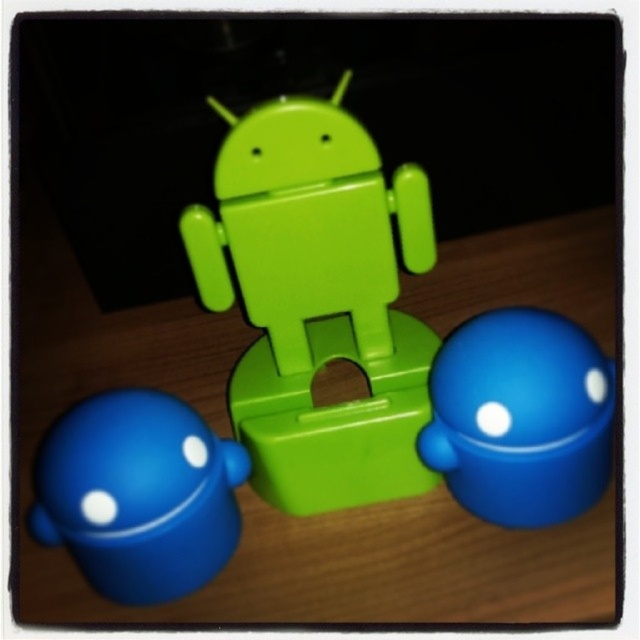
Can you confirm if wooden table at center is positioned to the left of green matte android at center?

Yes, wooden table at center is to the left of green matte android at center.

Between wooden table at center and green matte android at center, which one has more height?

With more height is wooden table at center.

Where is `wooden table at center`? The width and height of the screenshot is (640, 640). wooden table at center is located at coordinates (260, 499).

Identify the location of wooden table at center. Image resolution: width=640 pixels, height=640 pixels. (260, 499).

Does green matte android at center appear on the left side of matte blue toy at lower left?

Incorrect, green matte android at center is not on the left side of matte blue toy at lower left.

Is green matte android at center in front of matte blue toy at lower left?

No, it is not.

This screenshot has height=640, width=640. Describe the element at coordinates (317, 301) in the screenshot. I see `green matte android at center` at that location.

Where is `green matte android at center`? The image size is (640, 640). green matte android at center is located at coordinates [317, 301].

Can you confirm if wooden table at center is positioned to the right of matte blue sphere at lower right?

Incorrect, wooden table at center is not on the right side of matte blue sphere at lower right.

Does wooden table at center appear over matte blue sphere at lower right?

Yes, wooden table at center is above matte blue sphere at lower right.

I want to click on wooden table at center, so click(260, 499).